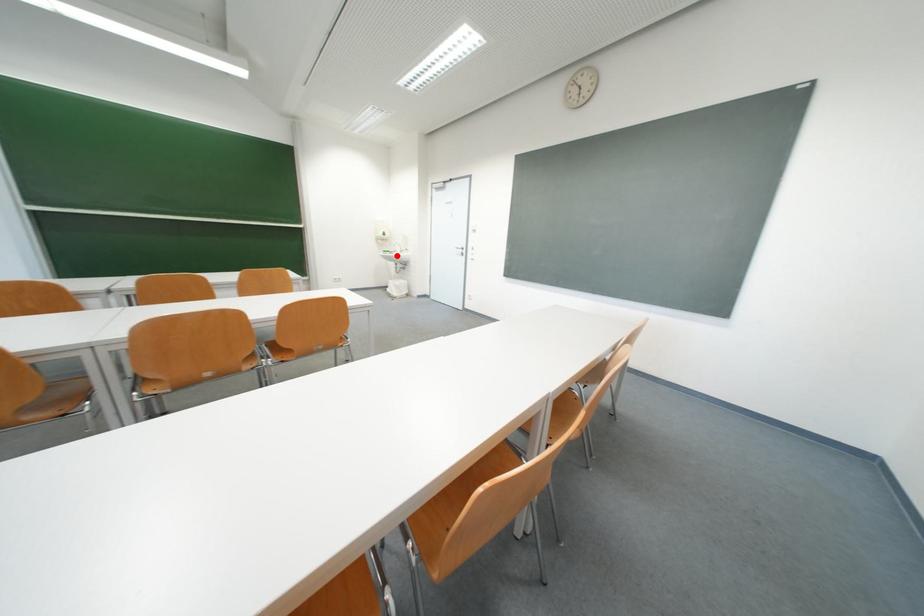
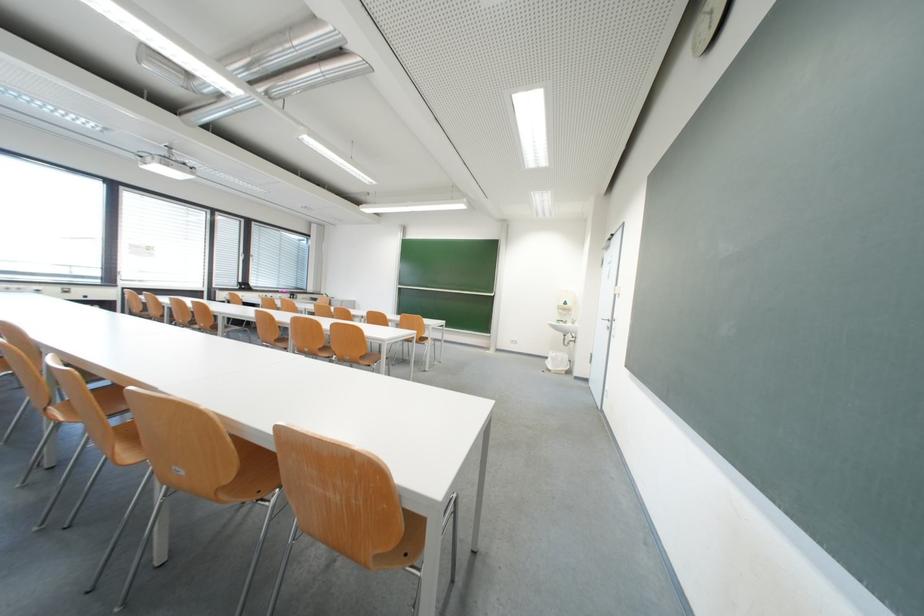
Find the pixel in the second image that matches the highlighted location in the first image.

(570, 326)